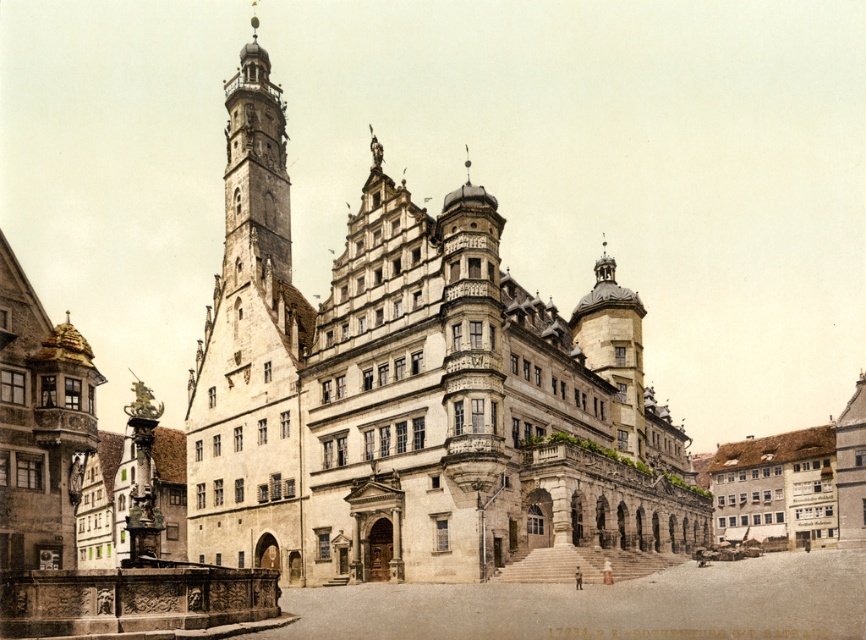
Consider the image. You are a tourist standing in the town square facing the stone building at center and the stone tower at left. Which structure is closer to you?

The stone building at center is closer to you because it is in front of the stone tower at left.

You are a tourist standing in the town square and want to take a photo of both the stone building at center and the stone tower at left. To ensure both are fully visible in your frame, should you position yourself to the left or right of the two structures?

You should position yourself to the right of the stone tower at left and stone building at center because the stone building at center is positioned on the right side of the stone tower at left, so placing yourself to the right would allow both structures to be captured in the photo.

In the scene shown: You are a tour guide leading a group of visitors to the historic town square. You want to ensure everyone can hear your commentary clearly. The sound system you have can project sound up to 40 feet. If you stand at the stone tower at left, will your voice reach all the way to the stone building at center?

The stone building at center and stone tower at left are 38.41 feet apart from each other. Since the sound system can project up to 40 feet, the distance between them is within the system capacity. Therefore, standing at the stone tower at left, your voice will reach the stone building at center.